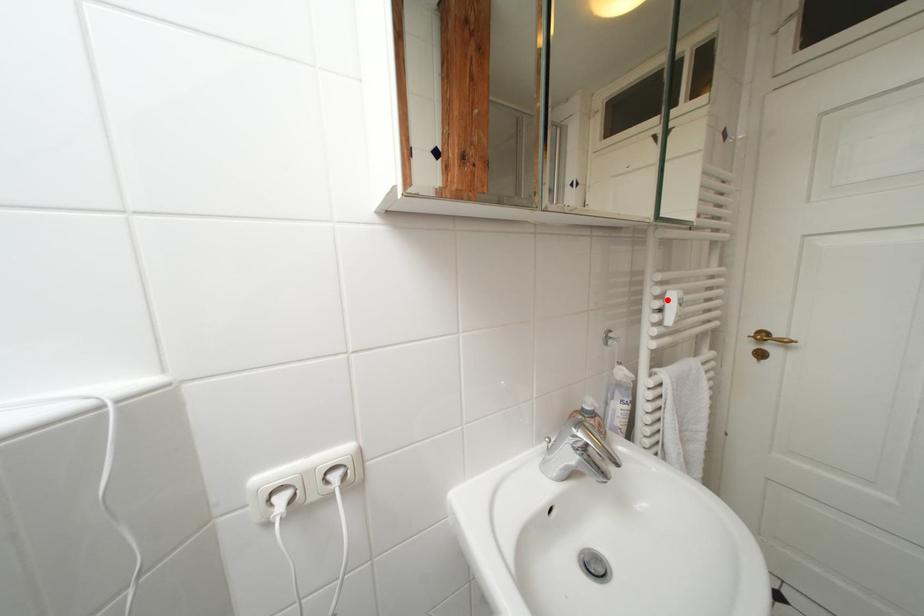
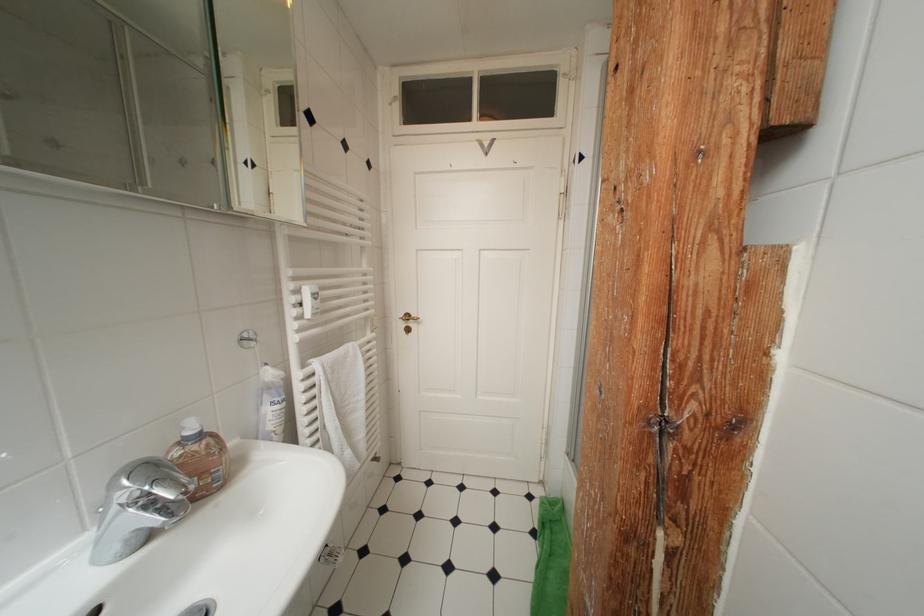
Find the pixel in the second image that matches the highlighted location in the first image.

(304, 294)